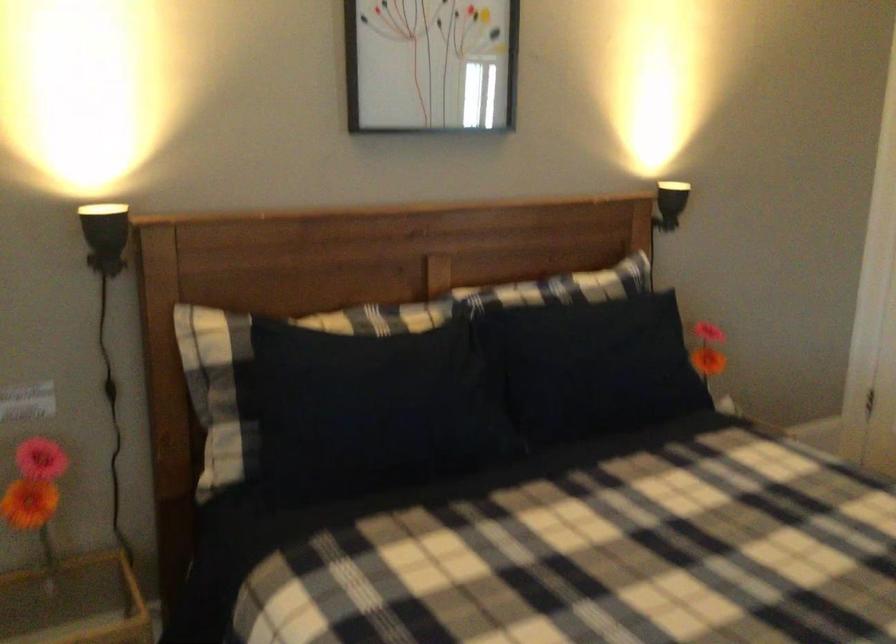
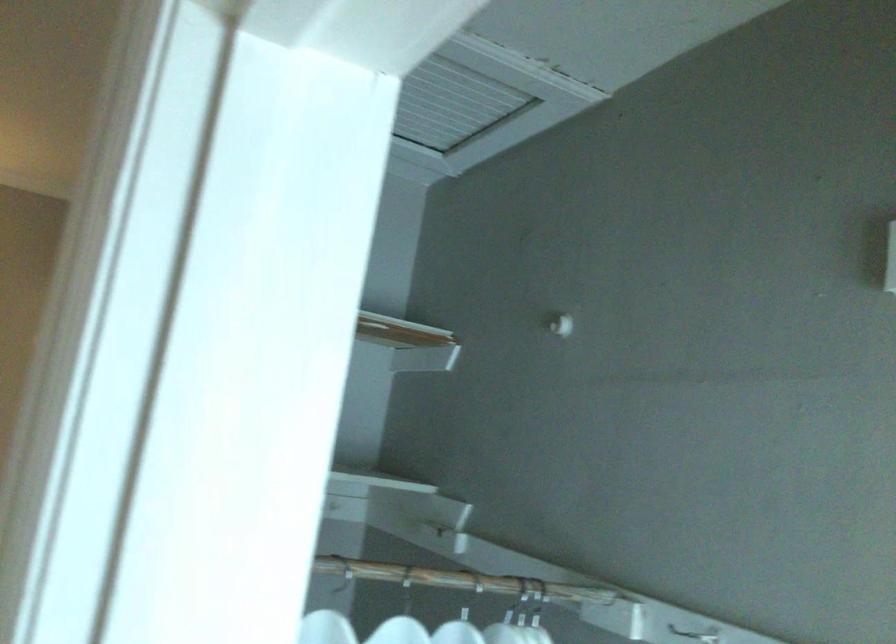
Question: The images are taken continuously from a first-person perspective. In which direction are you moving?

Choices:
 (A) Left
 (B) Right
 (C) Forward
 (D) Backward

Answer: (B)